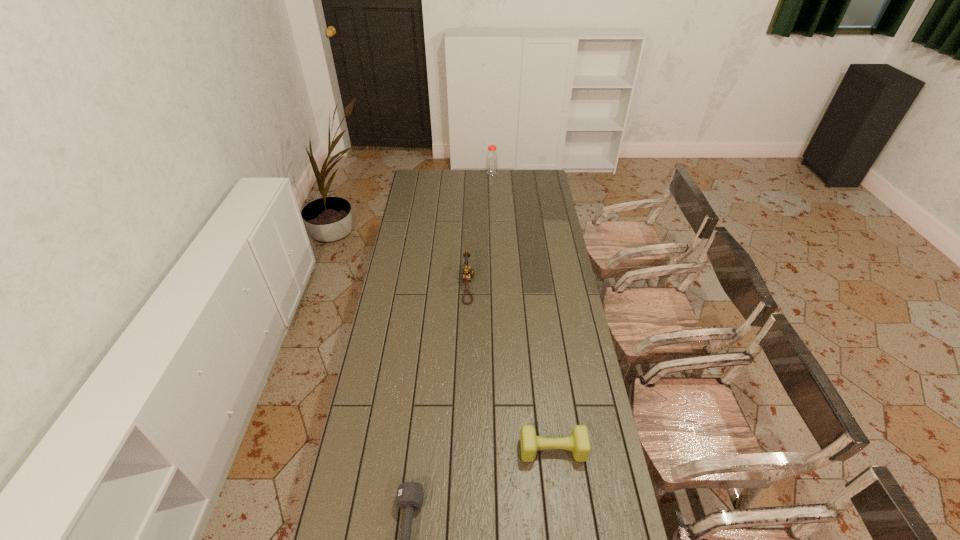
Image resolution: width=960 pixels, height=540 pixels. Find the location of `free region that satisfies the following two spatial constraints: 1. on the front-facing side of the second farthest object; 2. on the back side of the taller dumbbell`. free region that satisfies the following two spatial constraints: 1. on the front-facing side of the second farthest object; 2. on the back side of the taller dumbbell is located at coordinates [x=464, y=450].

Locate an element on the screen. free point that satisfies the following two spatial constraints: 1. on the front-facing side of the second farthest object; 2. on the left side of the third farthest object is located at coordinates (464, 450).

Locate an element on the screen. free space that satisfies the following two spatial constraints: 1. on the front-facing side of the second object from left to right; 2. on the right side of the third farthest object is located at coordinates click(464, 450).